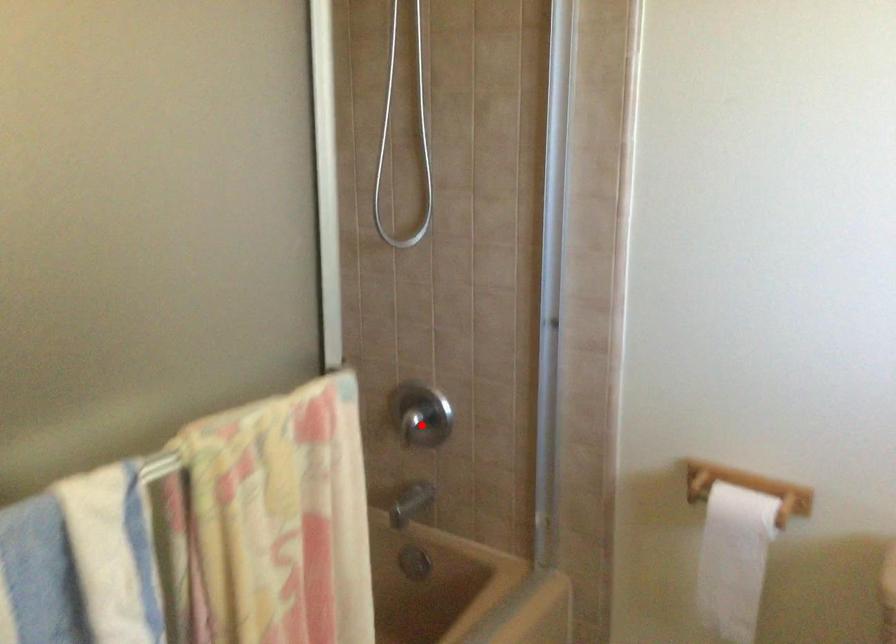
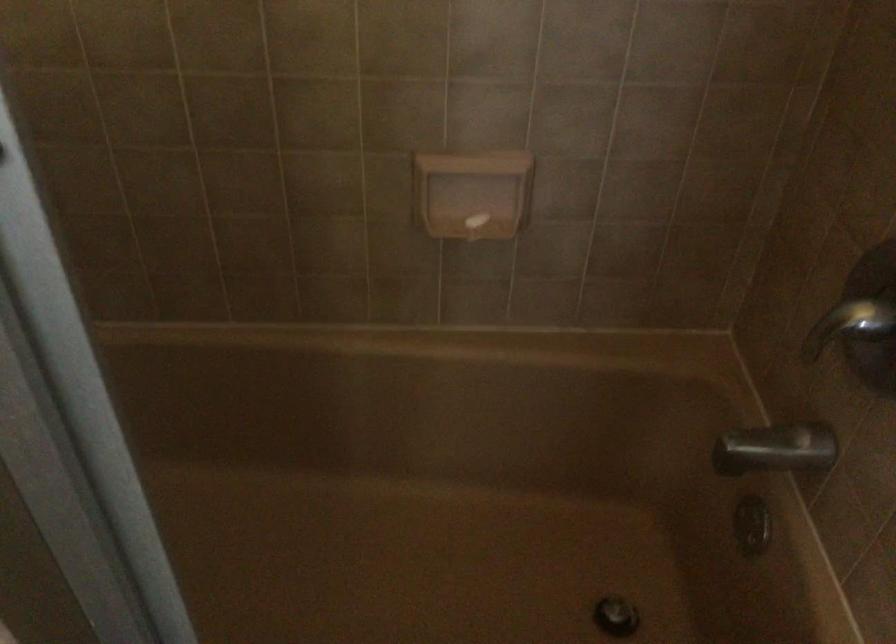
Find the pixel in the second image that matches the highlighted location in the first image.

(849, 325)